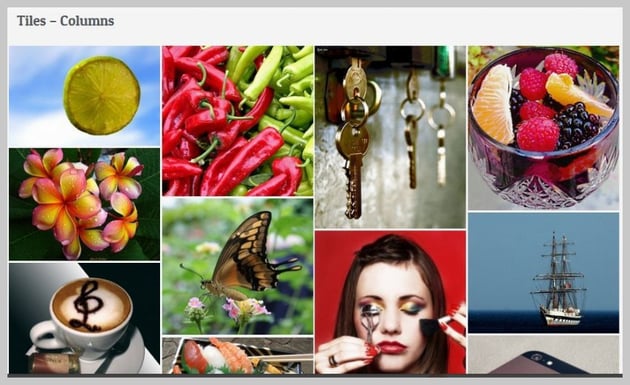
In order to click on keys in this screenshot , I will do `click(356, 83)`, `click(411, 86)`, `click(348, 143)`, `click(442, 136)`, `click(411, 137)`.